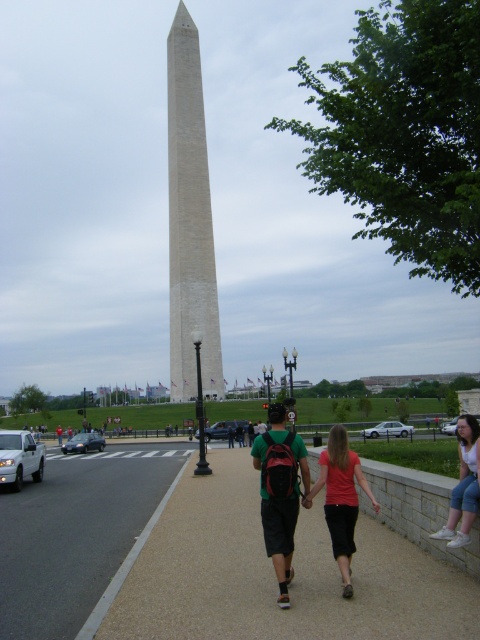
Question: Which of the following is the closest to the observer?

Choices:
 (A) silver metallic sedan at center
 (B) white metallic sedan at center-right
 (C) white matte van at lower left
 (D) silver metallic sedan at lower right

Answer: (C)

Question: Based on their relative distances, which object is farther from the matte green t-shirt at center?

Choices:
 (A) smooth concrete sidewalk at center
 (B) shiny silver sedan at center-left
 (C) white stone obelisk at center
 (D) matte red shirt at center

Answer: (C)

Question: Is shiny silver sedan at center-left positioned in front of silver metallic sedan at center?

Choices:
 (A) no
 (B) yes

Answer: (B)

Question: Can you confirm if white matte van at lower left is positioned to the left of silver metallic sedan at center?

Choices:
 (A) yes
 (B) no

Answer: (A)

Question: Estimate the real-world distances between objects in this image. Which object is closer to the matte green t-shirt at center?

Choices:
 (A) gray concrete sidewalk at lower center
 (B) smooth concrete sidewalk at center
 (C) white matte van at lower left
 (D) shiny silver sedan at center-left

Answer: (B)

Question: Does white matte van at lower left have a greater width compared to shiny silver sedan at center-left?

Choices:
 (A) no
 (B) yes

Answer: (B)